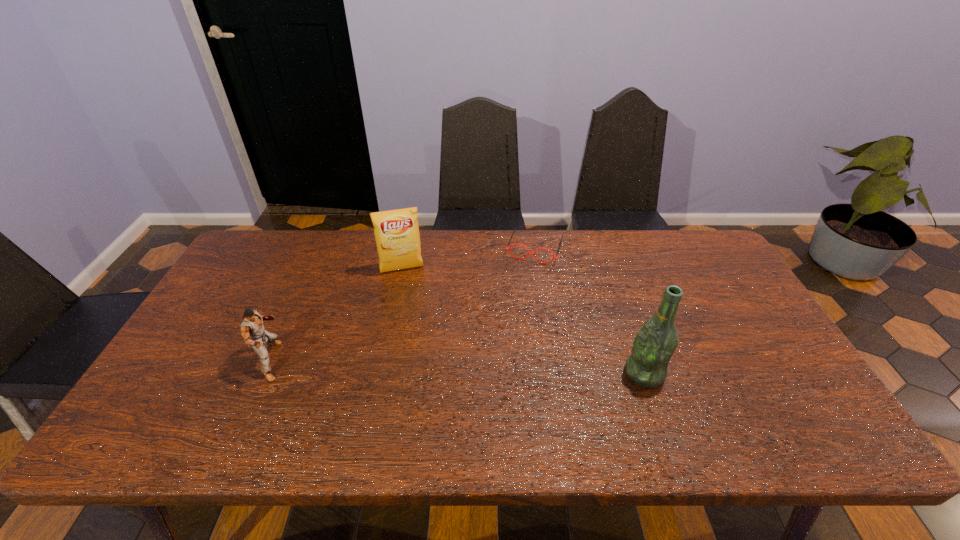
At what (x,y) coordinates should I click in order to perform the action: click on vacant space located 0.060m on the surface of the beer bottle. Please return your answer as a coordinate pair (x, y). The width and height of the screenshot is (960, 540). Looking at the image, I should click on [x=601, y=373].

Locate an element on the screen. This screenshot has width=960, height=540. free region located on the surface of the beer bottle is located at coordinates (597, 373).

This screenshot has height=540, width=960. In order to click on vacant space located on the front-facing side of the shortest object in this screenshot , I will do `click(503, 346)`.

You are a GUI agent. You are given a task and a screenshot of the screen. Output one action in this format:
    pyautogui.click(x=<x>, y=<y>)
    Task: Click on the vacant space located 0.340m on the front-facing side of the shortest object
    This screenshot has width=960, height=540.
    Given the screenshot: What is the action you would take?
    pyautogui.click(x=504, y=343)

What are the coordinates of `blank area located 0.120m on the front-facing side of the shortest object` in the screenshot? It's located at (521, 289).

At what (x,y) coordinates should I click in order to perform the action: click on free region located 0.050m on the front of the second object from left to right with the logo. Please return your answer as a coordinate pair (x, y). Image resolution: width=960 pixels, height=540 pixels. Looking at the image, I should click on (408, 287).

What are the coordinates of `free space located on the front of the second object from left to right with the logo` in the screenshot? It's located at (424, 366).

Identify the location of vacant space located on the front of the second object from left to right with the logo. (419, 337).

You are a GUI agent. You are given a task and a screenshot of the screen. Output one action in this format:
    pyautogui.click(x=<x>, y=<y>)
    Task: Click on the spectacles that is at the far edge
    The height and width of the screenshot is (540, 960).
    Given the screenshot: What is the action you would take?
    pyautogui.click(x=515, y=228)

Identify the location of crisp (potato chip) situated at the far edge. Image resolution: width=960 pixels, height=540 pixels. (396, 232).